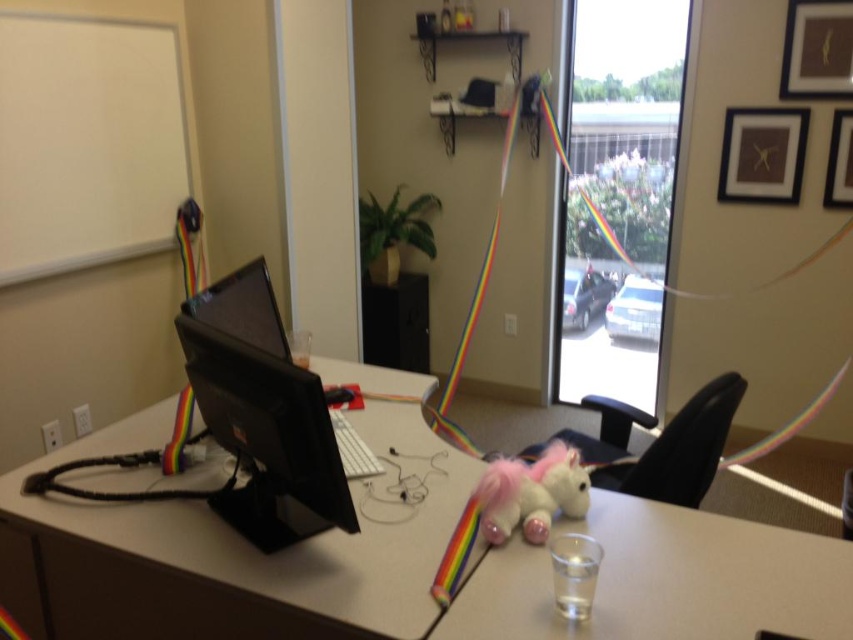
Question: Can you confirm if black glossy monitor at center is positioned to the right of plush pink unicorn at center?

Choices:
 (A) yes
 (B) no

Answer: (B)

Question: Can you confirm if matte black monitor at center is thinner than black glossy monitor at center?

Choices:
 (A) yes
 (B) no

Answer: (B)

Question: Among these objects, which one is nearest to the camera?

Choices:
 (A) black glossy monitor at center
 (B) plush pink unicorn at center

Answer: (A)

Question: Considering the real-world distances, which object is farthest from the plush pink unicorn at center?

Choices:
 (A) matte black monitor at center
 (B) black glossy monitor at center

Answer: (B)

Question: Is black glossy monitor at center above plush pink unicorn at center?

Choices:
 (A) yes
 (B) no

Answer: (A)

Question: Which of the following is the farthest from the observer?

Choices:
 (A) (293, 420)
 (B) (793, 630)

Answer: (A)